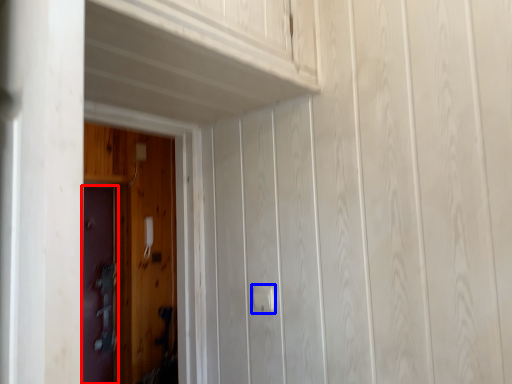
Question: Which of the following is the farthest to the observer, door (highlighted by a red box) or door handle (highlighted by a blue box)?

Choices:
 (A) door
 (B) door handle

Answer: (A)